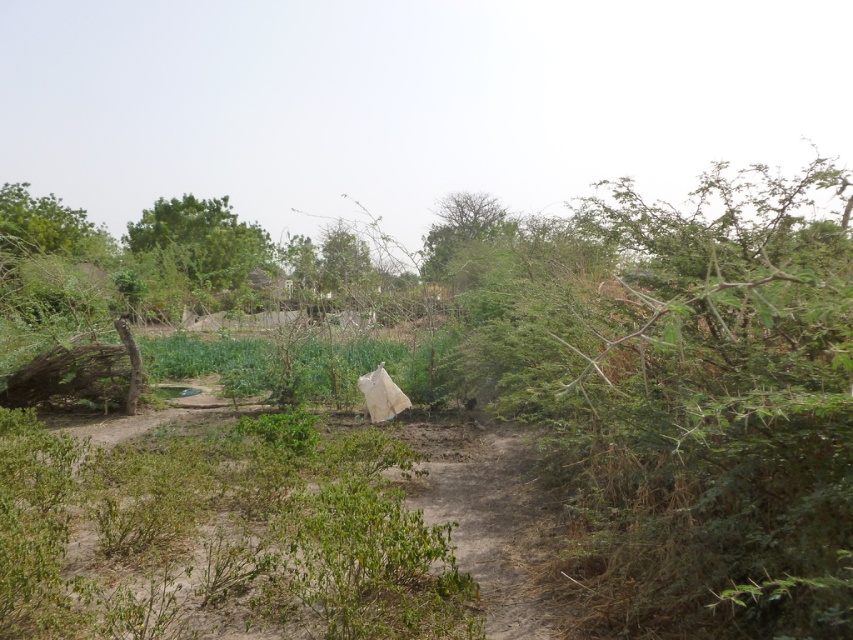
Question: Is green leafy tree at upper left to the right of green leafy tree at center from the viewer's perspective?

Choices:
 (A) yes
 (B) no

Answer: (B)

Question: Can you confirm if green leafy tree at upper left is positioned below green leafy tree at center?

Choices:
 (A) no
 (B) yes

Answer: (B)

Question: Is green leafy tree at upper left to the right of green leafy tree at center from the viewer's perspective?

Choices:
 (A) no
 (B) yes

Answer: (A)

Question: Which point is farther from the camera taking this photo?

Choices:
 (A) (451, 221)
 (B) (209, 256)

Answer: (A)

Question: Which of the following is the farthest from the observer?

Choices:
 (A) (138, 221)
 (B) (427, 259)

Answer: (A)